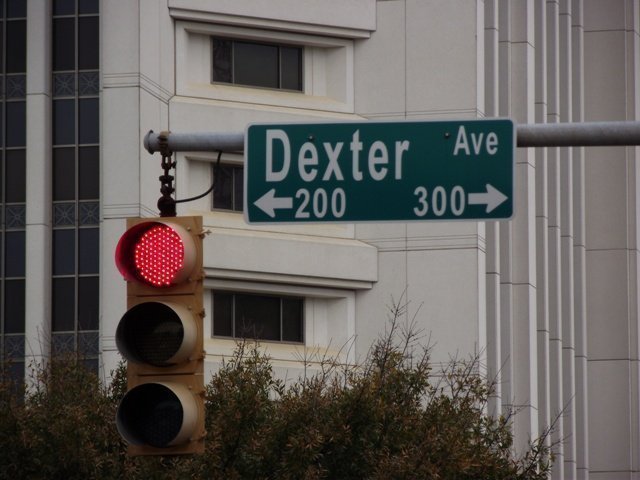
Where is `top window`? top window is located at coordinates (262, 67).